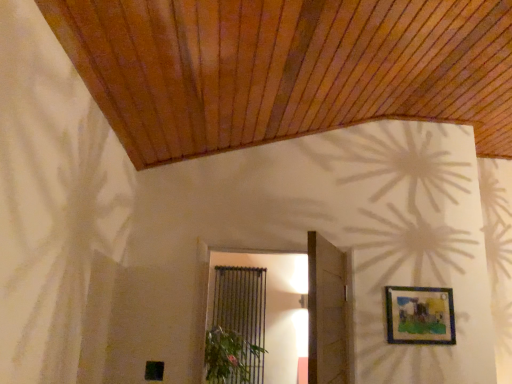
At what (x,y) coordinates should I click in order to perform the action: click on matte blue picture frame at upper right. Please return your answer as a coordinate pair (x, y). The height and width of the screenshot is (384, 512). Looking at the image, I should click on (420, 315).

The width and height of the screenshot is (512, 384). What do you see at coordinates (238, 326) in the screenshot?
I see `black metal screen door at center` at bounding box center [238, 326].

What is the approximate width of black metal screen door at center?

black metal screen door at center is 6.34 inches in width.

The image size is (512, 384). In order to click on matte blue picture frame at upper right in this screenshot , I will do `click(420, 315)`.

Consider the image. Is wooden door at center wider or thinner than black metal screen door at center?

Clearly, wooden door at center has less width compared to black metal screen door at center.

Considering the sizes of objects wooden door at center and black metal screen door at center in the image provided, who is taller, wooden door at center or black metal screen door at center?

wooden door at center.

From a real-world perspective, is wooden door at center positioned above or below black metal screen door at center?

In terms of real-world spatial position, wooden door at center is below black metal screen door at center.

Does green leafy plant at lower center appear on the right side of matte blue picture frame at upper right?

No, green leafy plant at lower center is not to the right of matte blue picture frame at upper right.

Is green leafy plant at lower center positioned beyond the bounds of matte blue picture frame at upper right?

Yes.

Does green leafy plant at lower center come in front of matte blue picture frame at upper right?

Yes, the depth of green leafy plant at lower center is less than that of matte blue picture frame at upper right.

Is green leafy plant at lower center shorter than matte blue picture frame at upper right?

Yes, green leafy plant at lower center is shorter than matte blue picture frame at upper right.

From a real-world perspective, is black metal screen door at center physically above matte blue picture frame at upper right?

Yes, from a real-world perspective, black metal screen door at center is on top of matte blue picture frame at upper right.

Could you tell me if black metal screen door at center is facing matte blue picture frame at upper right?

No, black metal screen door at center is not facing towards matte blue picture frame at upper right.

From the image's perspective, which is above, black metal screen door at center or matte blue picture frame at upper right?

matte blue picture frame at upper right, from the image's perspective.

Consider the image. Are black metal screen door at center and matte blue picture frame at upper right far apart?

Absolutely, black metal screen door at center is distant from matte blue picture frame at upper right.

Is matte blue picture frame at upper right completely or partially outside of black metal screen door at center?

matte blue picture frame at upper right is positioned outside black metal screen door at center.

Does matte blue picture frame at upper right have a lesser height compared to black metal screen door at center?

Yes, matte blue picture frame at upper right is shorter than black metal screen door at center.

Is matte blue picture frame at upper right with black metal screen door at center?

No, matte blue picture frame at upper right is not in contact with black metal screen door at center.

From a real-world perspective, is matte blue picture frame at upper right over black metal screen door at center?

No, from a real-world perspective, matte blue picture frame at upper right is not over black metal screen door at center

Does point (440, 301) come farther from viewer compared to point (323, 247)?

That is True.

Looking at this image, could you tell me if matte blue picture frame at upper right is facing wooden door at center?

No, matte blue picture frame at upper right is not oriented towards wooden door at center.

From the picture: Based on their sizes in the image, would you say matte blue picture frame at upper right is bigger or smaller than wooden door at center?

matte blue picture frame at upper right is smaller than wooden door at center.

Would you consider matte blue picture frame at upper right to be distant from wooden door at center?

No, there isn't a large distance between matte blue picture frame at upper right and wooden door at center.

Which object is closer to the camera taking this photo, wooden door at center or green leafy plant at lower center?

wooden door at center is more forward.

Does wooden door at center have a greater width compared to green leafy plant at lower center?

No, wooden door at center is not wider than green leafy plant at lower center.

Which is behind, point (337, 322) or point (243, 339)?

The point (243, 339) is more distant.

Based on their positions, is wooden door at center located to the left or right of green leafy plant at lower center?

In the image, wooden door at center appears on the right side of green leafy plant at lower center.

From the image's perspective, is green leafy plant at lower center located above or below wooden door at center?

green leafy plant at lower center is below wooden door at center.

Is green leafy plant at lower center inside the boundaries of wooden door at center, or outside?

green leafy plant at lower center is located beyond the bounds of wooden door at center.

From a real-world perspective, is green leafy plant at lower center on wooden door at center?

No, from a real-world perspective, green leafy plant at lower center is not over wooden door at center

Does green leafy plant at lower center appear on the left side of wooden door at center?

Yes.

Find the location of a particular element. screen door behind the wooden door at center is located at coordinates (238, 326).

Locate an element on the screen. The image size is (512, 384). plant below the matte blue picture frame at upper right (from a real-world perspective) is located at coordinates coord(229,357).

From the image, which object appears to be nearer to green leafy plant at lower center, wooden door at center or black metal screen door at center?

Based on the image, wooden door at center appears to be nearer to green leafy plant at lower center.

Considering their positions, is matte blue picture frame at upper right positioned closer to black metal screen door at center than green leafy plant at lower center?

green leafy plant at lower center is closer to black metal screen door at center.

Which object lies nearer to the anchor point wooden door at center, matte blue picture frame at upper right or black metal screen door at center?

matte blue picture frame at upper right is positioned closer to the anchor wooden door at center.

Looking at the image, which one is located closer to green leafy plant at lower center, wooden door at center or matte blue picture frame at upper right?

A: The object closer to green leafy plant at lower center is wooden door at center.

Based on their spatial positions, is black metal screen door at center or matte blue picture frame at upper right closer to wooden door at center?

Based on the image, matte blue picture frame at upper right appears to be nearer to wooden door at center.

Which object lies nearer to the anchor point green leafy plant at lower center, matte blue picture frame at upper right or wooden door at center?

The object closer to green leafy plant at lower center is wooden door at center.

Which object lies further to the anchor point matte blue picture frame at upper right, wooden door at center or black metal screen door at center?

Among the two, black metal screen door at center is located further to matte blue picture frame at upper right.

Looking at the image, which one is located further to green leafy plant at lower center, matte blue picture frame at upper right or black metal screen door at center?

Based on the image, black metal screen door at center appears to be further to green leafy plant at lower center.

You are a GUI agent. You are given a task and a screenshot of the screen. Output one action in this format:
    pyautogui.click(x=<x>, y=<y>)
    Task: Click on the door located between green leafy plant at lower center and matte blue picture frame at upper right in the left-right direction
    The width and height of the screenshot is (512, 384).
    Given the screenshot: What is the action you would take?
    pyautogui.click(x=326, y=312)

Identify the location of picture frame positioned between green leafy plant at lower center and black metal screen door at center from near to far. The height and width of the screenshot is (384, 512). (420, 315).

Where is `picture frame between wooden door at center and black metal screen door at center along the z-axis`? This screenshot has width=512, height=384. picture frame between wooden door at center and black metal screen door at center along the z-axis is located at coordinates (420, 315).

At what (x,y) coordinates should I click in order to perform the action: click on plant between wooden door at center and black metal screen door at center along the z-axis. Please return your answer as a coordinate pair (x, y). This screenshot has height=384, width=512. Looking at the image, I should click on (229, 357).